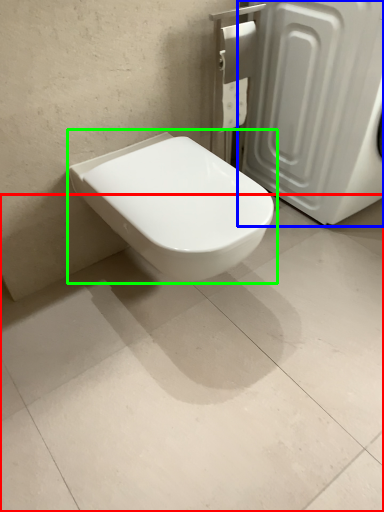
Question: Estimate the real-world distances between objects in this image. Which object is farther from concrete (highlighted by a red box), screen door (highlighted by a blue box) or toilet (highlighted by a green box)?

Choices:
 (A) screen door
 (B) toilet

Answer: (A)